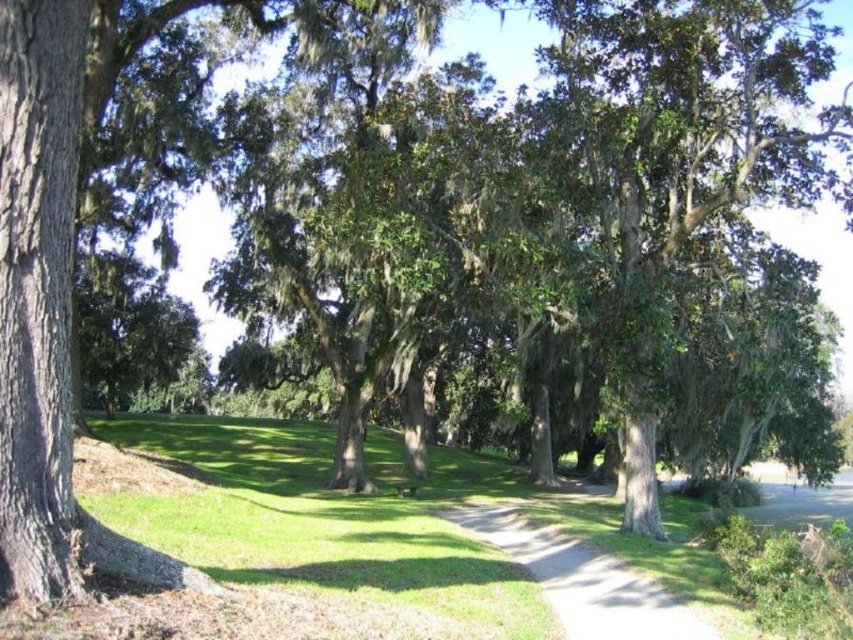
Is point (570, 632) in front of point (401, 493)?

Yes.

Which is below, smooth concrete path at center or wooden park bench at center?

wooden park bench at center is lower down.

Is point (611, 618) positioned in front of point (408, 486)?

Yes, point (611, 618) is closer to viewer.

At what (x,y) coordinates should I click in order to perform the action: click on smooth concrete path at center. Please return your answer as a coordinate pair (x, y). Looking at the image, I should click on (583, 579).